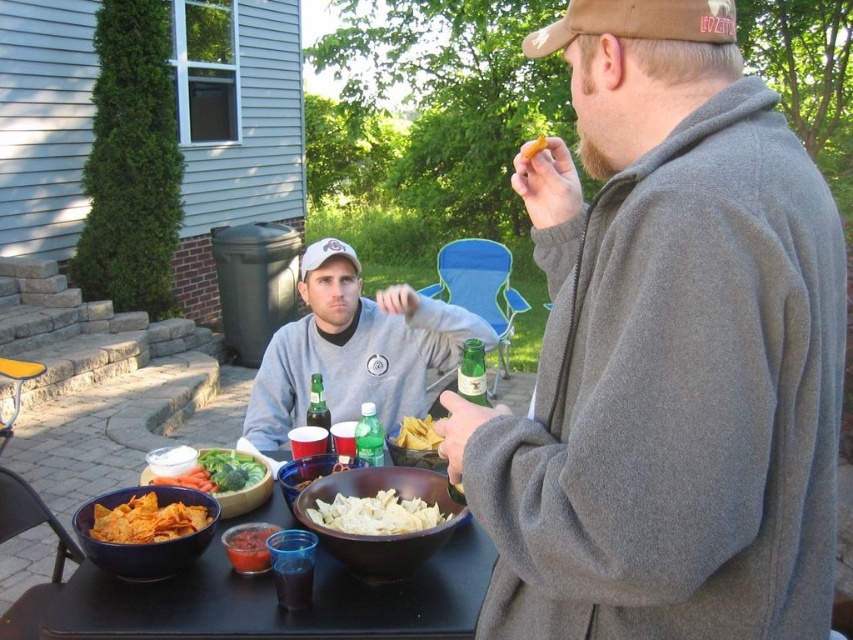
Who is higher up, gray fleece jacket at upper right or yellow plastic picnic table at lower left?

gray fleece jacket at upper right is higher up.

Consider the image. Can you confirm if gray fleece jacket at upper right is positioned above yellow plastic picnic table at lower left?

Indeed, gray fleece jacket at upper right is positioned over yellow plastic picnic table at lower left.

Who is more distant from viewer, (699, 294) or (16, 365)?

Point (16, 365)

Locate an element on the screen. The width and height of the screenshot is (853, 640). gray fleece jacket at upper right is located at coordinates (666, 355).

Based on the photo, measure the distance from matte brown bowl at center to yellow tortilla chips at center.

The distance of matte brown bowl at center from yellow tortilla chips at center is 18.62 inches.

Who is lower down, matte brown bowl at center or yellow tortilla chips at center?

matte brown bowl at center

The image size is (853, 640). Find the location of `matte brown bowl at center`. matte brown bowl at center is located at coordinates (276, 604).

You are a GUI agent. You are given a task and a screenshot of the screen. Output one action in this format:
    pyautogui.click(x=<x>, y=<y>)
    Task: Click on the matte brown bowl at center
    This screenshot has height=640, width=853.
    Given the screenshot: What is the action you would take?
    pyautogui.click(x=276, y=604)

Which of these two, white matte chips at center or matte orange tortilla chips at lower left, stands taller?

matte orange tortilla chips at lower left

Which is in front, point (349, 520) or point (154, 500)?

Positioned in front is point (349, 520).

The image size is (853, 640). What do you see at coordinates (376, 513) in the screenshot?
I see `white matte chips at center` at bounding box center [376, 513].

The width and height of the screenshot is (853, 640). Identify the location of white matte chips at center. (376, 513).